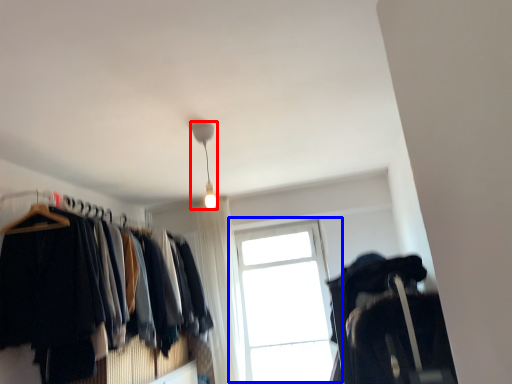
Question: Which point is further to the camera, lamp (highlighted by a red box) or window (highlighted by a blue box)?

Choices:
 (A) lamp
 (B) window

Answer: (B)